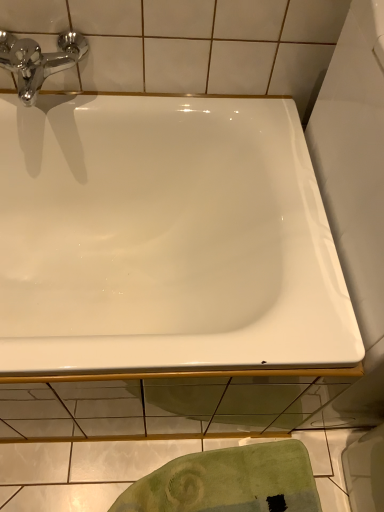
Question: Is white glossy bathtub at center inside or outside of green textured towel at lower center?

Choices:
 (A) outside
 (B) inside

Answer: (A)

Question: Is white glossy bathtub at center bigger or smaller than green textured towel at lower center?

Choices:
 (A) big
 (B) small

Answer: (A)

Question: Considering the real-world distances, which object is farthest from the chrome/metallic faucet at upper left?

Choices:
 (A) white glossy bathtub at center
 (B) green textured towel at lower center

Answer: (B)

Question: Estimate the real-world distances between objects in this image. Which object is farther from the green textured towel at lower center?

Choices:
 (A) chrome/metallic faucet at upper left
 (B) white glossy bathtub at center

Answer: (A)